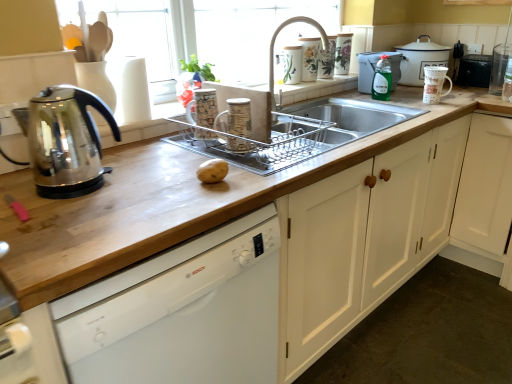
Find the location of a particular element. vacant space that is to the left of transparent glass kettle at left, the first kitchen appliance in the left-to-right sequence is located at coordinates (20, 180).